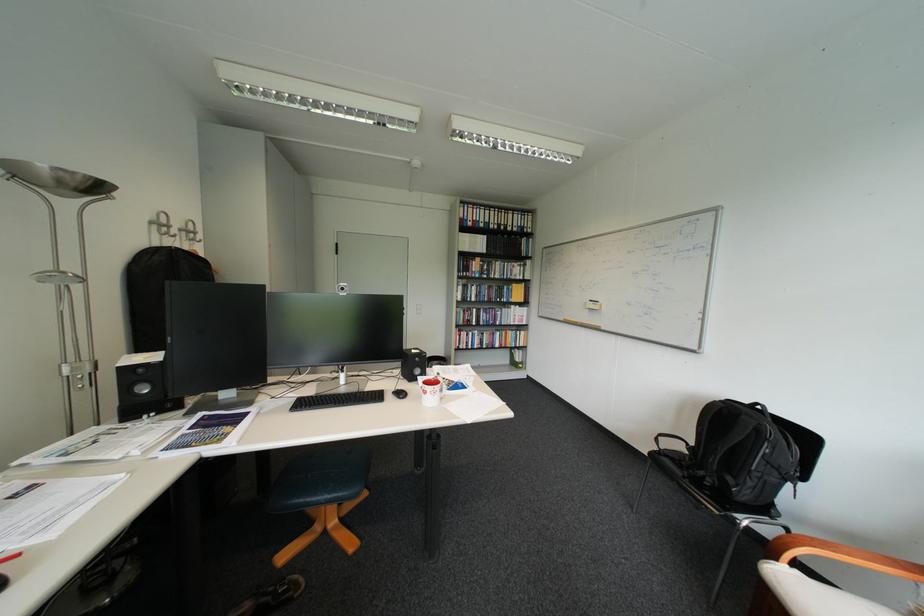
At what (x,y) coordinates should I click in order to perform the action: click on black chair sitting surface. Please return your answer as a coordinate pair (x, y). Looking at the image, I should click on (314, 485).